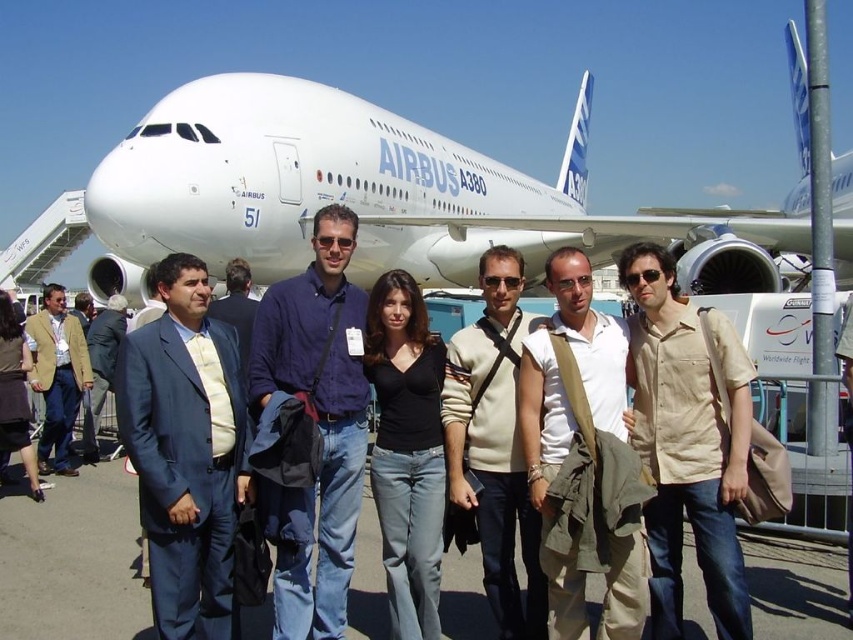
You are standing at the center of the image and want to find the beige cotton shirt at center. According to the coordinates provided, in which direction should you look to locate it?

The beige cotton shirt at center is located at coordinates point (688, 442), which means you should look slightly to the right and upward from the center to find it.

You are a photographer at an airshow and notice two items at the center of the scene. The beige sweater at center and the tan canvas bag at center. Which item is bigger?

The beige sweater at center has a larger size compared to the tan canvas bag at center, so the beige sweater at center is bigger.